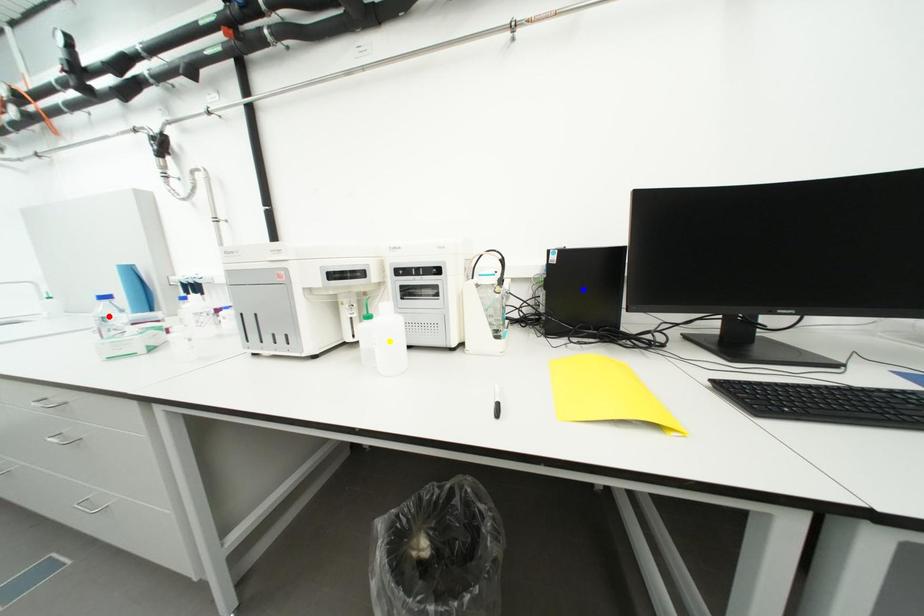
Order these from nearest to farthest:
- red point
- blue point
- yellow point

1. yellow point
2. blue point
3. red point